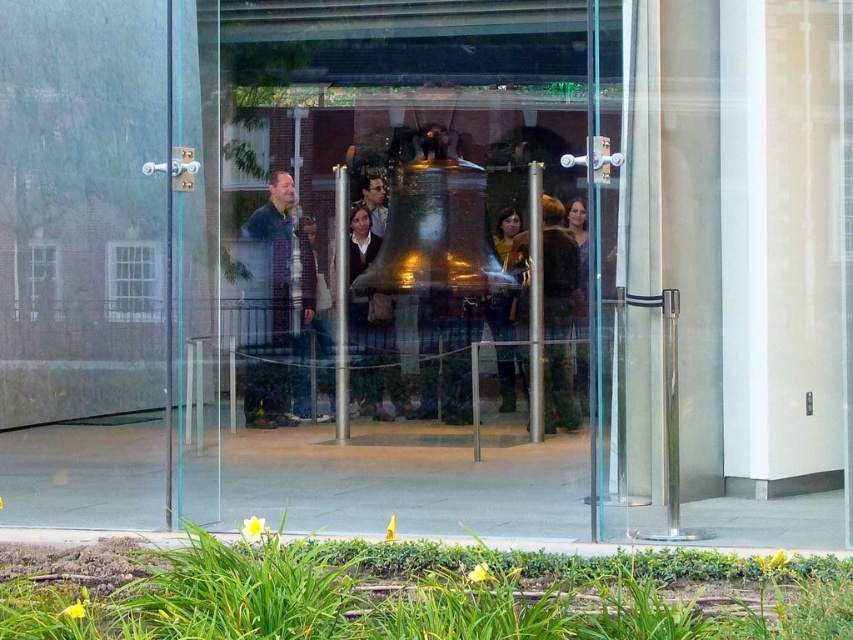
Question: Does matte blue shirt at center have a smaller size compared to brown leather jacket at center?

Choices:
 (A) yes
 (B) no

Answer: (B)

Question: Which point is farther from the camera taking this photo?

Choices:
 (A) (550, 321)
 (B) (590, 0)
 (C) (274, 195)

Answer: (C)

Question: Among these points, which one is farthest from the camera?

Choices:
 (A) (280, 273)
 (B) (502, 387)

Answer: (A)

Question: Can you confirm if transparent glass door at center is bigger than matte blue shirt at center?

Choices:
 (A) no
 (B) yes

Answer: (A)

Question: Which point appears closest to the camera in this image?

Choices:
 (A) (268, 243)
 (B) (305, 392)

Answer: (B)

Question: Does transparent glass door at center appear under matte blue shirt at center?

Choices:
 (A) no
 (B) yes

Answer: (B)